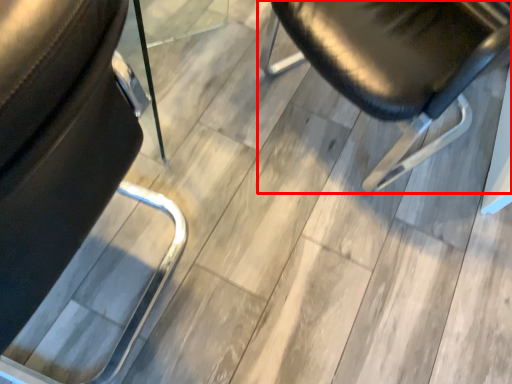
Question: In this image, where is chair (annotated by the red box) located relative to chair?

Choices:
 (A) left
 (B) right

Answer: (B)